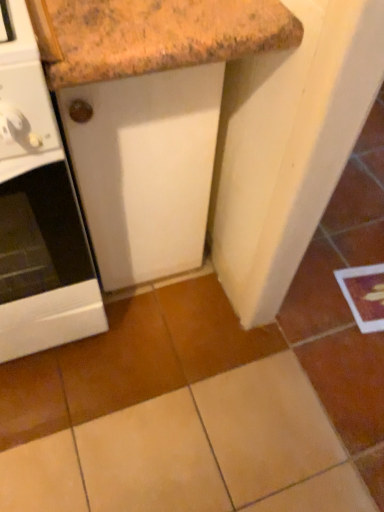
You are a GUI agent. You are given a task and a screenshot of the screen. Output one action in this format:
    pyautogui.click(x=<x>, y=<y>)
    Task: Click on the vacant space in front of white glossy oven at left
    The width and height of the screenshot is (384, 512).
    Given the screenshot: What is the action you would take?
    pyautogui.click(x=79, y=439)